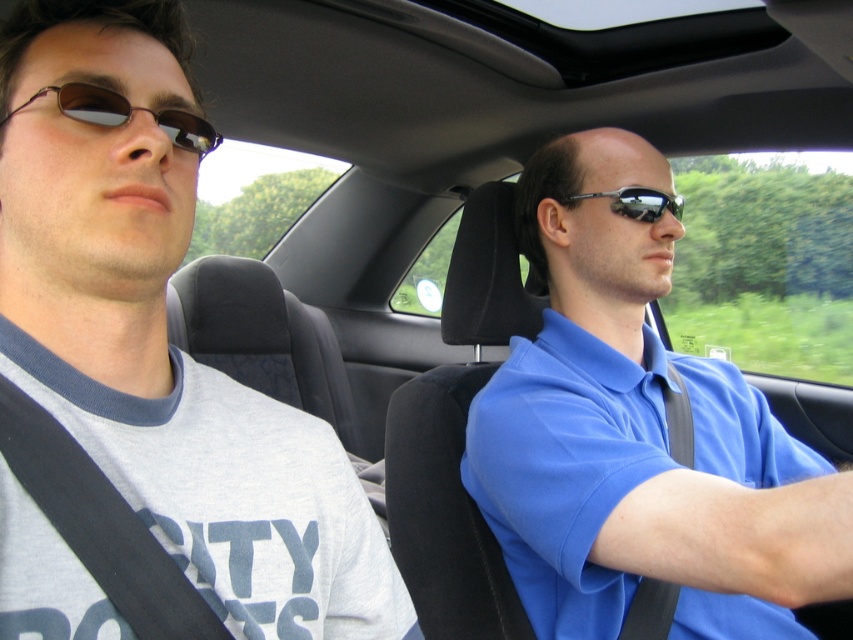
Does gray cotton t-shirt at left have a larger size compared to matte brown sunglasses at left?

Yes, gray cotton t-shirt at left is bigger than matte brown sunglasses at left.

Does gray cotton t-shirt at left appear over matte brown sunglasses at left?

No.

Where is `gray cotton t-shirt at left`? The image size is (853, 640). gray cotton t-shirt at left is located at coordinates (161, 332).

Is matte brown sunglasses at left wider than shiny black sunglasses at center?

Incorrect, matte brown sunglasses at left's width does not surpass shiny black sunglasses at center's.

At what (x,y) coordinates should I click in order to perform the action: click on matte brown sunglasses at left. Please return your answer as a coordinate pair (x, y). The image size is (853, 640). Looking at the image, I should click on (126, 115).

The width and height of the screenshot is (853, 640). Find the location of `matte brown sunglasses at left`. matte brown sunglasses at left is located at coordinates (126, 115).

You are a GUI agent. You are given a task and a screenshot of the screen. Output one action in this format:
    pyautogui.click(x=<x>, y=<y>)
    Task: Click on the matte brown sunglasses at left
    The height and width of the screenshot is (640, 853).
    Given the screenshot: What is the action you would take?
    pyautogui.click(x=126, y=115)

Can you confirm if gray cotton t-shirt at left is positioned below blue cotton shirt at center?

No, gray cotton t-shirt at left is not below blue cotton shirt at center.

Does gray cotton t-shirt at left have a lesser height compared to blue cotton shirt at center?

Yes, gray cotton t-shirt at left is shorter than blue cotton shirt at center.

I want to click on gray cotton t-shirt at left, so click(161, 332).